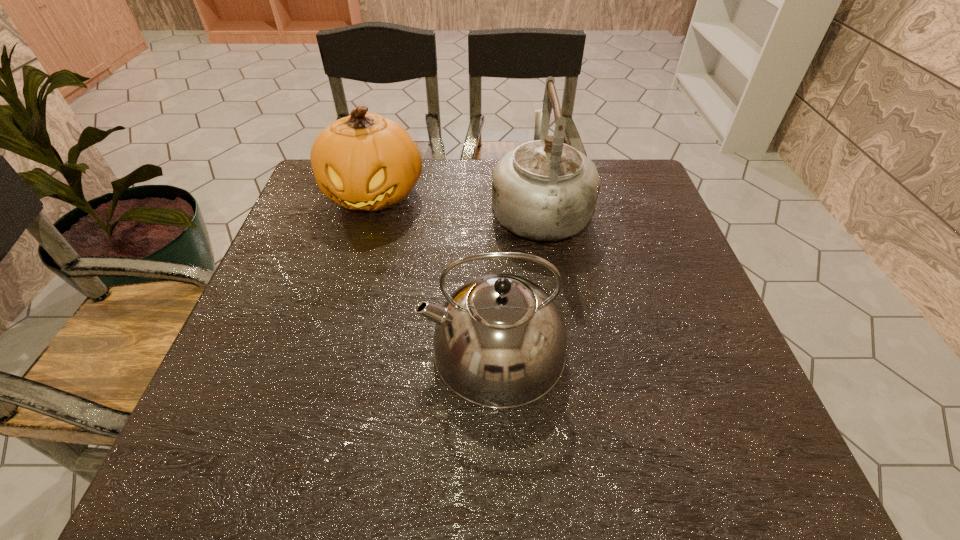
Locate an element on the screen. The height and width of the screenshot is (540, 960). pumpkin located at the far edge is located at coordinates (364, 161).

The image size is (960, 540). I want to click on object that is at the left edge, so click(364, 161).

Find the location of a particular element. object positioned at the far left corner is located at coordinates (364, 161).

In order to click on vacant space at the near edge in this screenshot , I will do `click(563, 482)`.

This screenshot has width=960, height=540. Find the location of `blank space at the left edge`. blank space at the left edge is located at coordinates (217, 403).

Locate an element on the screen. vacant space at the right edge of the desktop is located at coordinates (689, 404).

In the image, there is a desktop. Where is `blank space at the far left corner`? blank space at the far left corner is located at coordinates (324, 195).

Locate an element on the screen. The height and width of the screenshot is (540, 960). blank space at the far right corner of the desktop is located at coordinates (608, 181).

Identify the location of vacant region at the near right corner of the desktop. The width and height of the screenshot is (960, 540). (755, 460).

In order to click on vacant point located between the farther kettle and the leftmost object in this screenshot , I will do `click(457, 201)`.